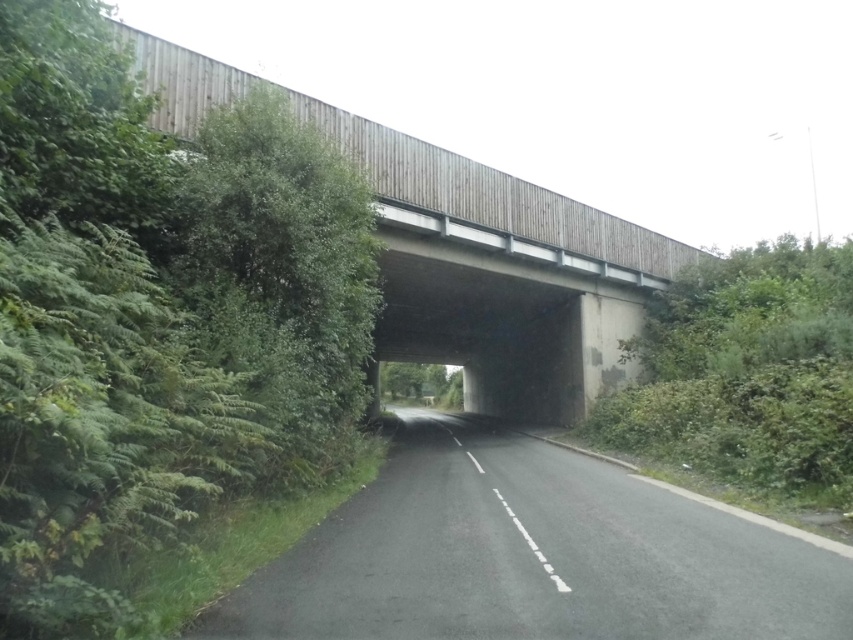
Question: Can you confirm if black asphalt road at center is positioned to the right of wooden bridge at center?

Choices:
 (A) no
 (B) yes

Answer: (A)

Question: Can you confirm if black asphalt road at center is thinner than wooden bridge at center?

Choices:
 (A) yes
 (B) no

Answer: (A)

Question: Among these points, which one is nearest to the camera?

Choices:
 (A) (463, 276)
 (B) (247, 580)

Answer: (B)

Question: Is black asphalt road at center wider than wooden bridge at center?

Choices:
 (A) no
 (B) yes

Answer: (A)